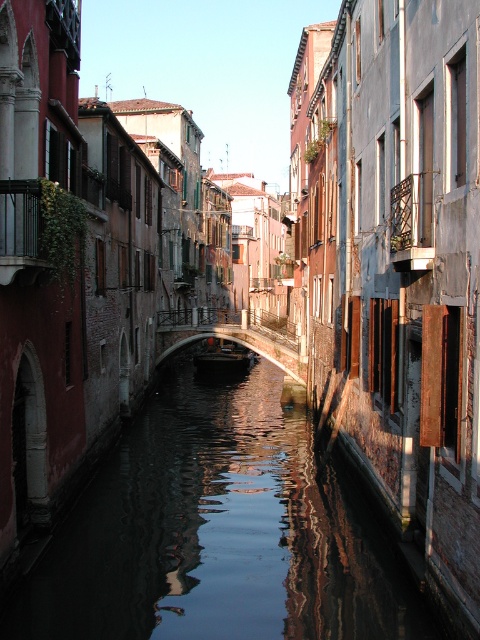
You are a tourist standing on a bridge overlooking the canal. You want to take a photo that captures both the reflective dark water at center and the wooden dark brown boat at center. Which object will occupy more space in your photo?

The reflective dark water at center will occupy more space in the photo because it is larger in size than the wooden dark brown boat at center.

You are standing at the edge of a canal in a historic European city and want to toss a coin into the water. The coin has a diameter of 1 inch. Considering the reflective dark water at center is 33.65 feet away, can you accurately toss the coin into the water from your current position?

The reflective dark water at center is 33.65 feet away from the viewer. Since the coin has a diameter of 1 inch, tossing it accurately from that distance would be very challenging due to the significant distance involved. It is unlikely you can accurately toss the coin into the water from 33.65 feet away.